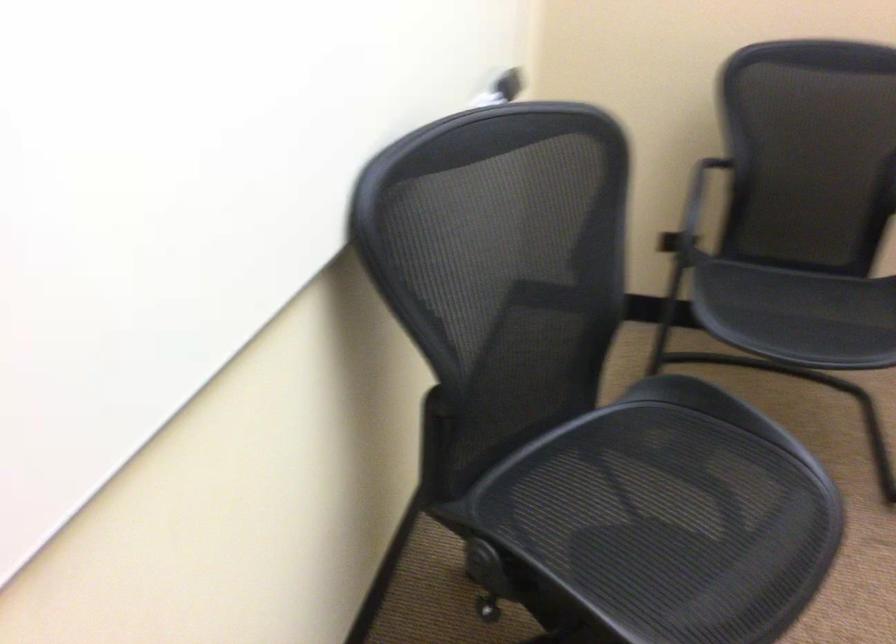
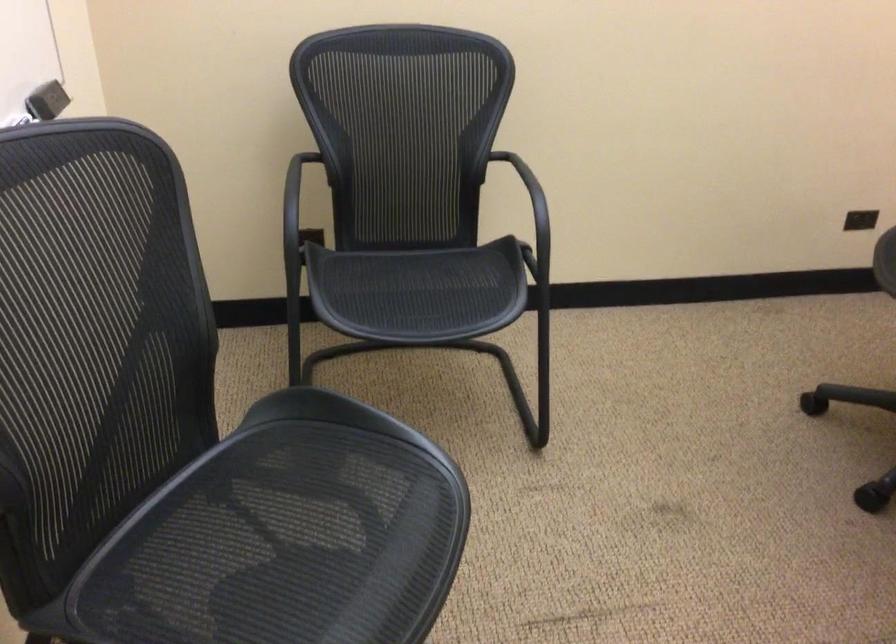
Find the pixel in the second image that matches [695,189] in the first image.

(298, 201)